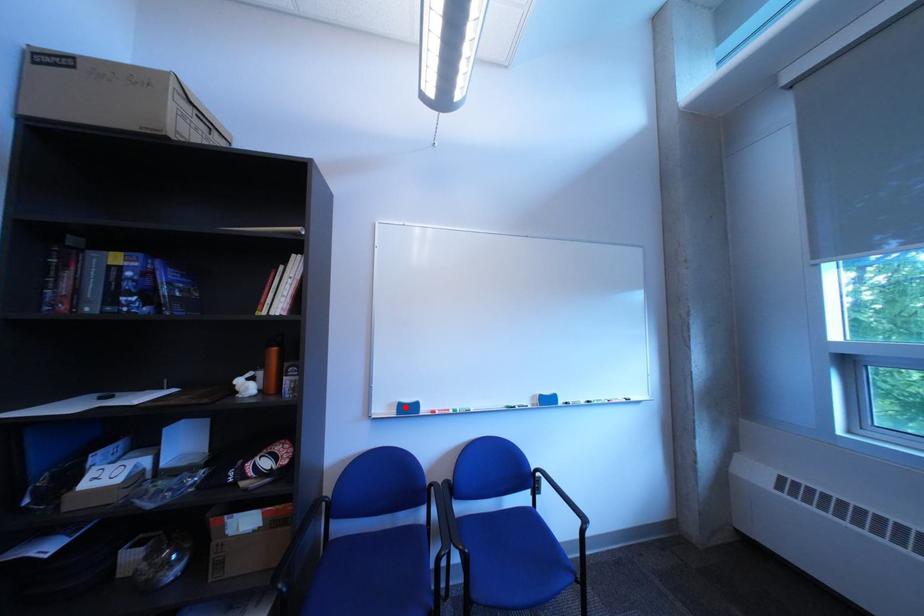
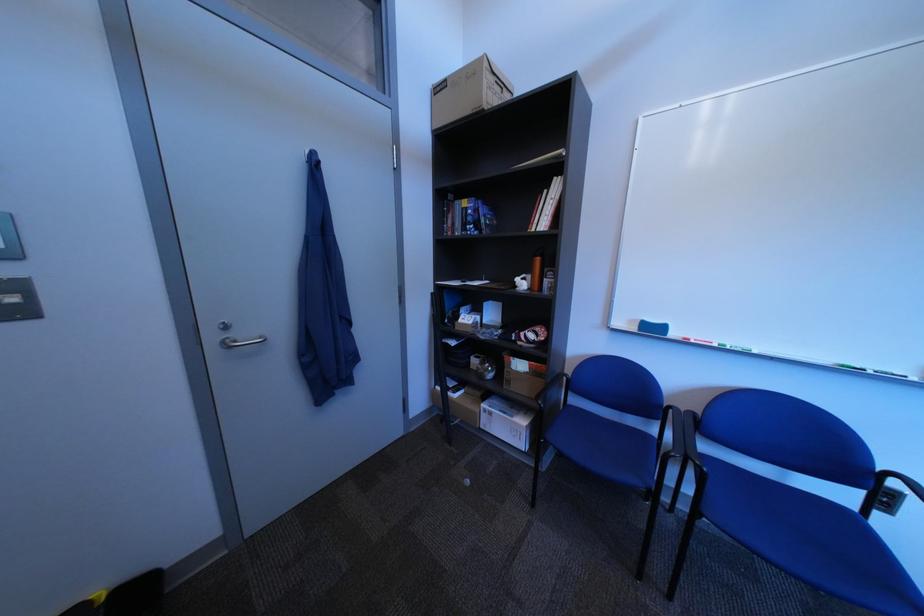
Where in the second image is the point corresponding to the highlighted location from the first image?

(647, 323)